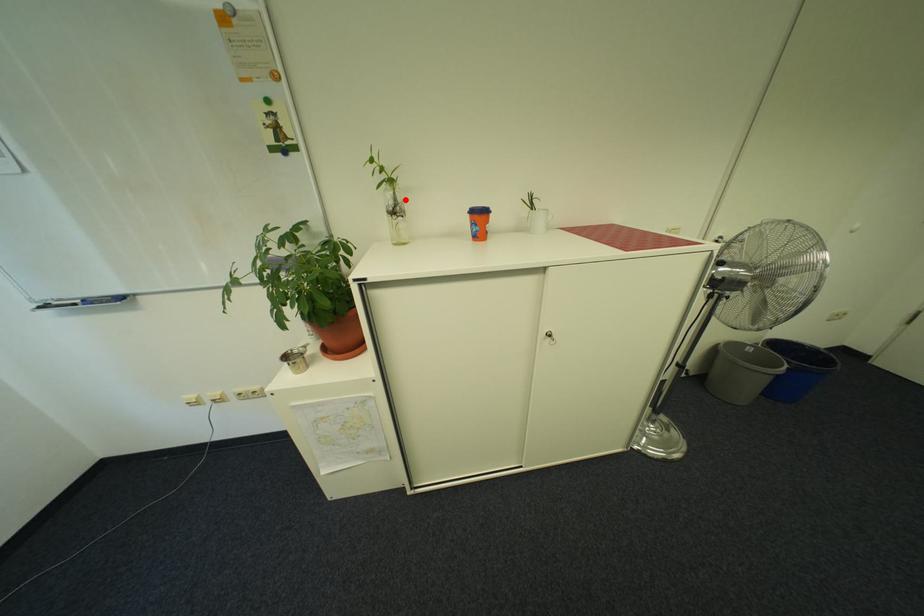
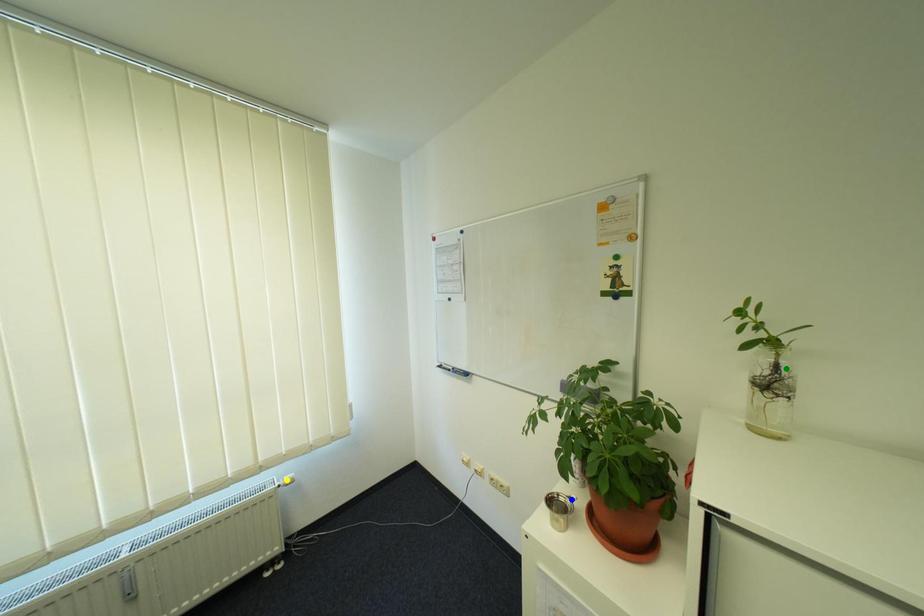
Question: I am providing you with two images of the same scene from different viewpoints. A red point is marked on the first image. You are given multiple points on the second image. Which point in image 2 is actually the same real-world point as the red point in image 1?

Choices:
 (A) blue point
 (B) green point
 (C) yellow point

Answer: (B)